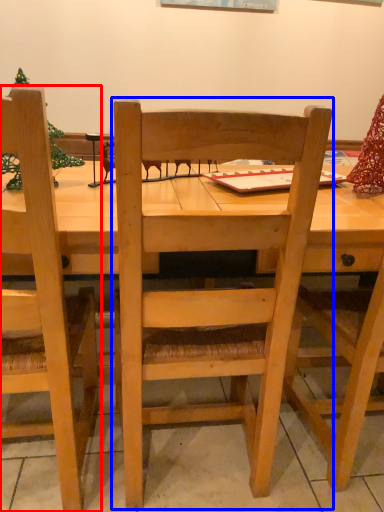
Question: Which of the following is the farthest to the observer, chair (highlighted by a red box) or chair (highlighted by a blue box)?

Choices:
 (A) chair
 (B) chair

Answer: (B)